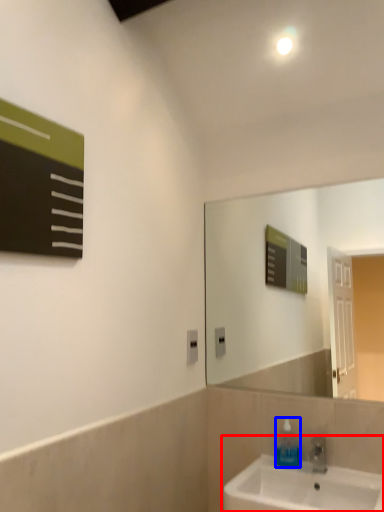
Question: Among these objects, which one is nearest to the camera, sink (highlighted by a red box) or soap dispenser (highlighted by a blue box)?

Choices:
 (A) sink
 (B) soap dispenser

Answer: (A)